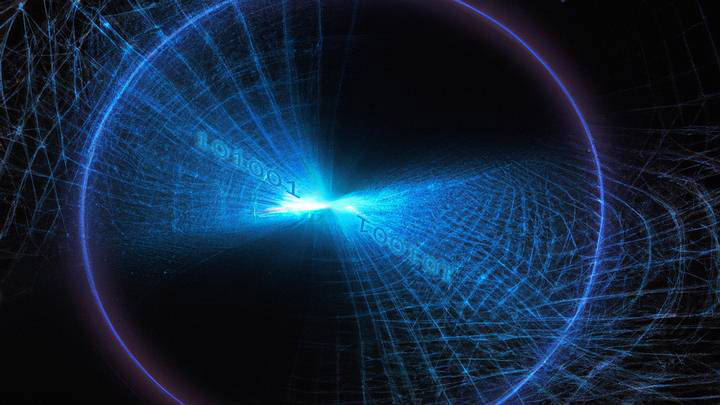
I want to click on bright light, so click(x=310, y=203).